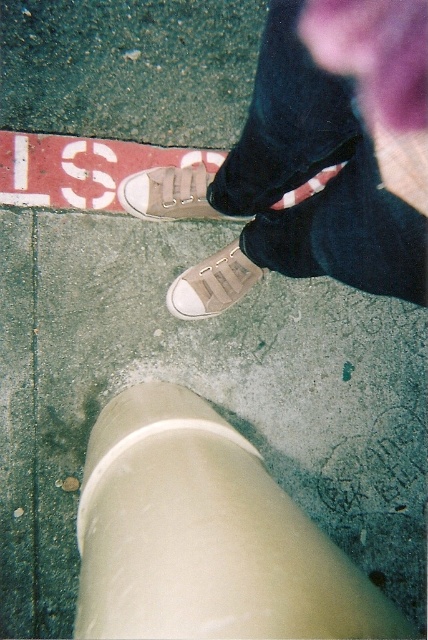
You are holding a small drone that has a 30 cm wingspan. You want to fly it from your current position to take a photo of the matte beige sneakers at center without getting too close. Can the drone stay above the sneakers while maintaining a safe distance of at least 30 cm away from them?

The matte beige sneakers at center and camera are 56.14 centimeters apart. Since the drone needs to stay at least 30 cm away, the current distance of 56.14 cm allows the drone to hover safely above the sneakers while maintaining the required distance.

You are standing on the sidewalk and see the point marked at coordinates (315, 160). What object is located at that point?

The point at coordinates (315, 160) corresponds to the matte beige sneakers at center.

You are a delivery robot with a width of 12 inches. You need to move from the matte beige sneakers at center to the matte beige canvas shoe at center. Can you fit through the space between them?

The matte beige sneakers at center and matte beige canvas shoe at center are 8.30 inches apart from each other. Since the robot is 12 inches wide, it cannot fit through the space between them as the distance is narrower than the robot.